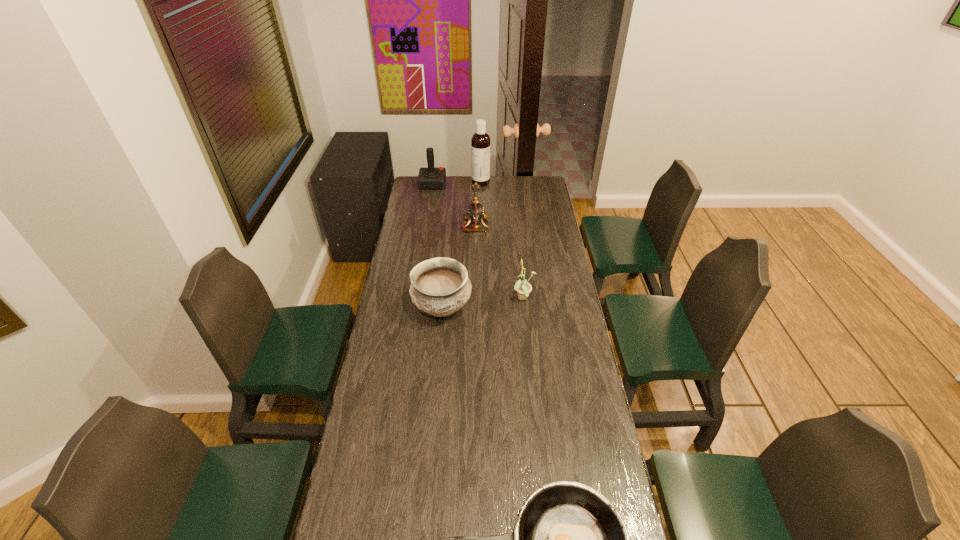
In the image, there is a desktop. Where is `vacant space at the left edge`? This screenshot has width=960, height=540. vacant space at the left edge is located at coordinates (417, 321).

Locate an element on the screen. This screenshot has width=960, height=540. free space at the right edge of the desktop is located at coordinates (538, 289).

Locate an element on the screen. free space between the tallest object and the sunflower is located at coordinates (502, 240).

Where is `free space between the telephone and the sunflower`? free space between the telephone and the sunflower is located at coordinates (500, 262).

You are a GUI agent. You are given a task and a screenshot of the screen. Output one action in this format:
    pyautogui.click(x=<x>, y=<y>)
    Task: Click on the free area in between the sunflower and the pottery
    
    Given the screenshot: What is the action you would take?
    pyautogui.click(x=483, y=303)

The height and width of the screenshot is (540, 960). Find the location of `vacant space that is in between the pottery and the sunflower`. vacant space that is in between the pottery and the sunflower is located at coordinates (483, 303).

Identify the location of vacant space that is in between the pottery and the sunflower. (483, 303).

What are the coordinates of `vacant area that lies between the pottery and the sunflower` in the screenshot? It's located at (483, 303).

At what (x,y) coordinates should I click in order to perform the action: click on free space between the telephone and the sunflower. Please return your answer as a coordinate pair (x, y). The width and height of the screenshot is (960, 540). Looking at the image, I should click on (500, 262).

Point out which object is positioned as the fifth nearest to the sunflower. Please provide its 2D coordinates. Your answer should be formatted as a tuple, i.e. [(x, y)], where the tuple contains the x and y coordinates of a point satisfying the conditions above.

[(429, 178)]